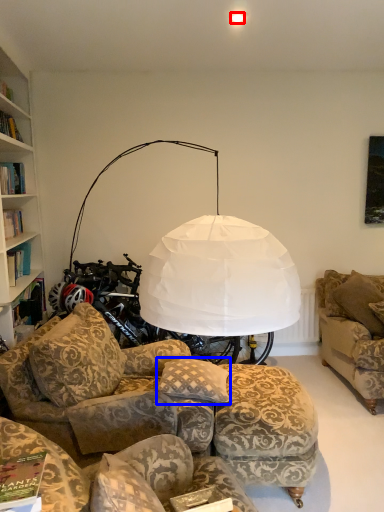
Question: Which object is further to the camera taking this photo, lighting (highlighted by a red box) or pillow (highlighted by a blue box)?

Choices:
 (A) lighting
 (B) pillow

Answer: (A)